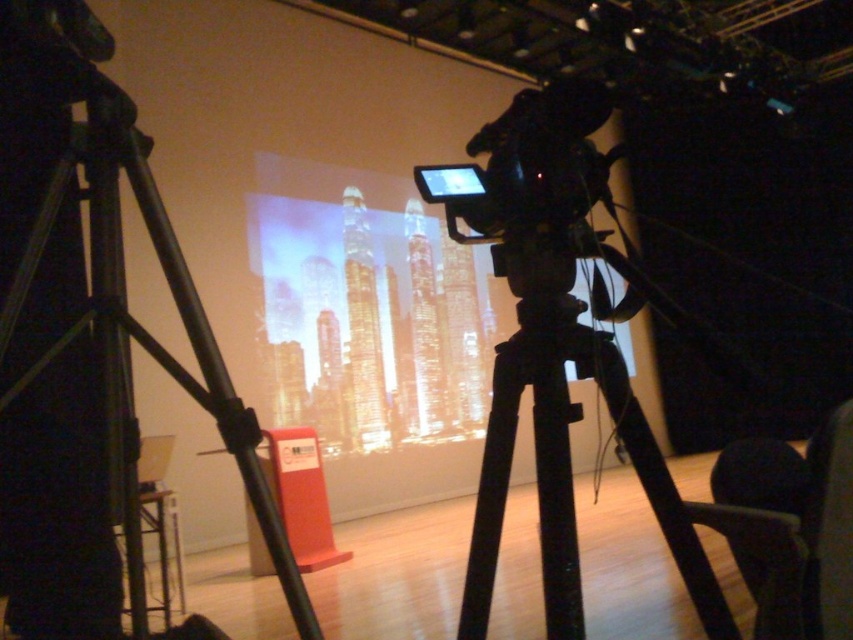
You are setting up a live broadcast and need to position a 1.8m tall person in front of the matte glass screen at center and the black plastic camera at center. Which object should the person stand closer to to ensure they are fully visible on the screen and properly framed by the camera?

The matte glass screen at center is much taller than the black plastic camera at center, so the person should stand closer to the matte glass screen at center to ensure they are fully visible on the screen and properly framed by the camera.

You are setting up equipment for a live stream. You have a black matte tripod at center and a black plastic camera at center. Which of these two items has a greater width?

The black matte tripod at center has a larger width than the black plastic camera at center.

You are a camera operator adjusting the focus of the two points in the scene. The first point is point (480, 410) and the second point is point (543, 112). Which point should you focus on first if you want to ensure both points are in focus?

You should focus on point (543, 112) first because it is closer to the camera than point (480, 410). By focusing on the closer point, the depth of field will naturally include the farther point as well.